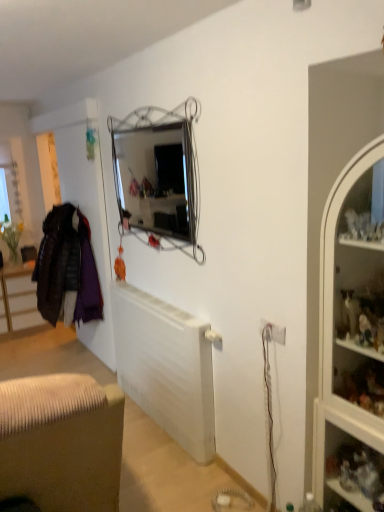
Question: Does point (352, 501) appear closer or farther from the camera than point (352, 373)?

Choices:
 (A) closer
 (B) farther

Answer: (A)

Question: Looking at the image, does clear glass shelves at right seem bigger or smaller compared to white glass cabinet at right?

Choices:
 (A) big
 (B) small

Answer: (B)

Question: Which of these objects is positioned farthest from the white matte radiator at center?

Choices:
 (A) white glass cabinet at right
 (B) white plastic electric outlet at lower right
 (C) velvet purple coat at left
 (D) clear glass shelves at right
 (E) brown fabric cabinet at lower left

Answer: (E)

Question: Estimate the real-world distances between objects in this image. Which object is farther from the white matte radiator at center?

Choices:
 (A) brown fabric cabinet at lower left
 (B) white glass cabinet at right
 (C) velvet purple coat at left
 (D) white plastic electric outlet at lower right
 (E) clear glass shelves at right

Answer: (A)